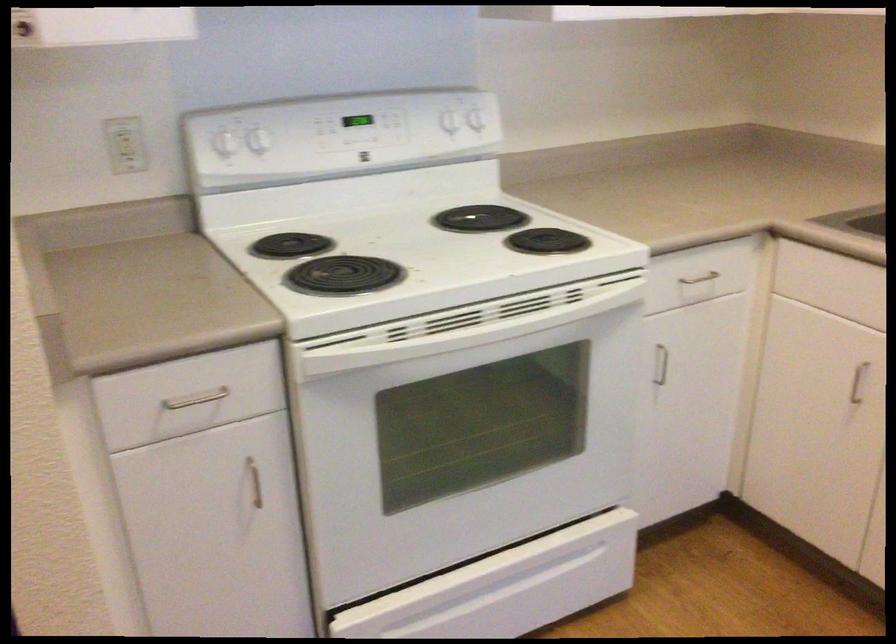
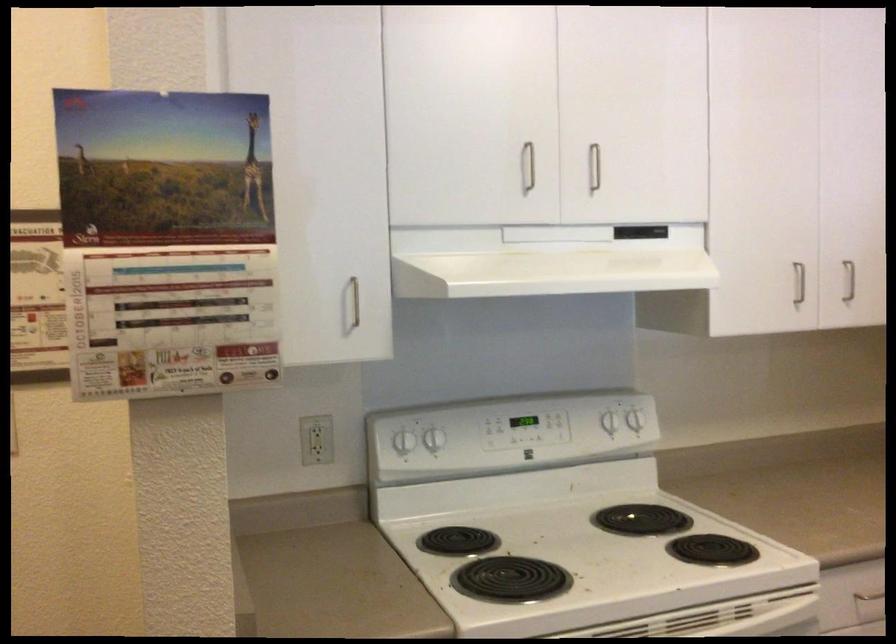
Question: The first image is from the beginning of the video and the second image is from the end. How did the camera likely rotate when shooting the video?

Choices:
 (A) Left
 (B) Right
 (C) Up
 (D) Down

Answer: (C)